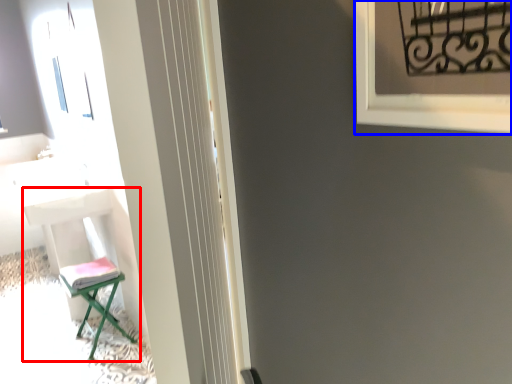
Question: Which object appears closest to the camera in this image, furniture (highlighted by a red box) or window frame (highlighted by a blue box)?

Choices:
 (A) furniture
 (B) window frame

Answer: (B)